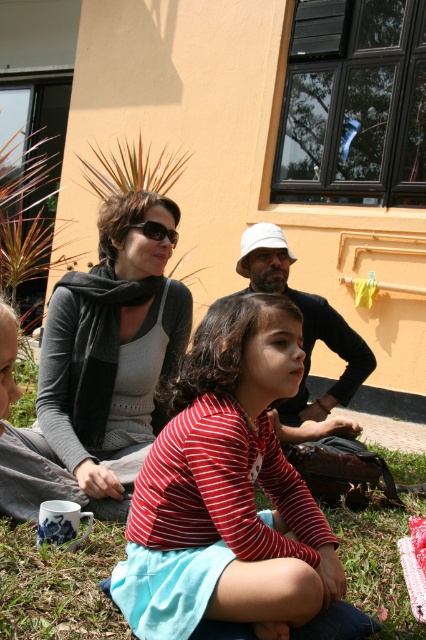
Who is positioned more to the right, green grass at lower center or matte black shirt at center?

green grass at lower center is more to the right.

This screenshot has height=640, width=426. What are the coordinates of `green grass at lower center` in the screenshot? It's located at (58, 586).

Who is more forward, (371, 566) or (282, 289)?

Point (371, 566)

Find the location of a particular element. The height and width of the screenshot is (640, 426). green grass at lower center is located at coordinates (58, 586).

Is green grass at lower center below black plastic sunglasses at center?

Yes.

Who is positioned more to the left, green grass at lower center or black plastic sunglasses at center?

black plastic sunglasses at center

The height and width of the screenshot is (640, 426). What do you see at coordinates (58, 586) in the screenshot? I see `green grass at lower center` at bounding box center [58, 586].

Locate an element on the screen. Image resolution: width=426 pixels, height=640 pixels. green grass at lower center is located at coordinates (58, 586).

Consider the image. Who is taller, striped cotton shirt at center or black plastic sunglasses at center?

striped cotton shirt at center is taller.

The image size is (426, 640). Identify the location of striped cotton shirt at center. (227, 490).

Where is `striped cotton shirt at center`? striped cotton shirt at center is located at coordinates (227, 490).